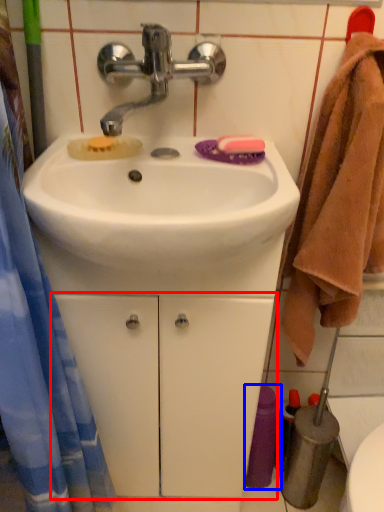
Question: Which object is closer to the camera taking this photo, drawer (highlighted by a red box) or toiletry (highlighted by a blue box)?

Choices:
 (A) drawer
 (B) toiletry

Answer: (A)